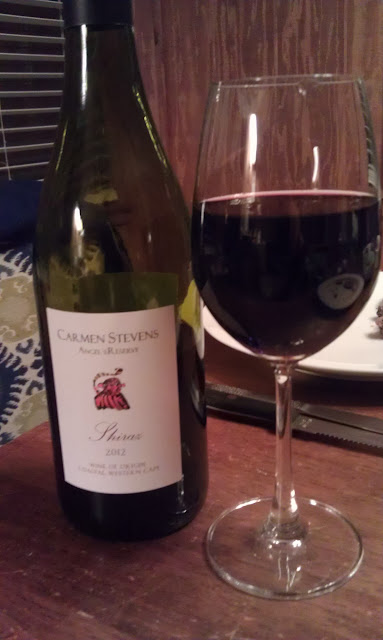
The width and height of the screenshot is (383, 640). What are the coordinates of `plate` in the screenshot? It's located at (330, 367).